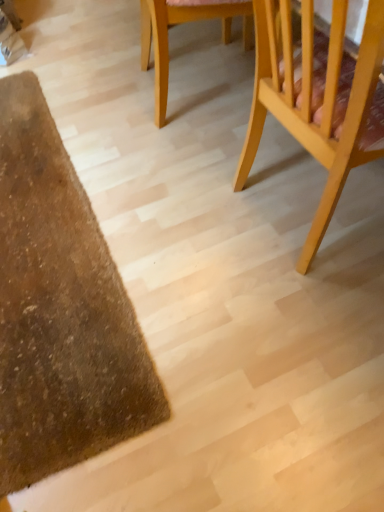
Question: Is light wood chair at right, placed as the 2th chair when sorted from left to right, bigger or smaller than light wood chair at upper center, the 1th chair when ordered from left to right?

Choices:
 (A) big
 (B) small

Answer: (A)

Question: From the image's perspective, is light wood chair at right, placed as the 2th chair when sorted from left to right, positioned above or below light wood chair at upper center, the 1th chair when ordered from left to right?

Choices:
 (A) above
 (B) below

Answer: (B)

Question: Is point (365, 22) closer or farther from the camera than point (168, 52)?

Choices:
 (A) closer
 (B) farther

Answer: (A)

Question: Considering the relative positions of light wood chair at upper center, marked as the 2th chair in a right-to-left arrangement, and light wood chair at right, placed as the 2th chair when sorted from left to right, in the image provided, is light wood chair at upper center, marked as the 2th chair in a right-to-left arrangement, to the left or to the right of light wood chair at right, placed as the 2th chair when sorted from left to right,?

Choices:
 (A) left
 (B) right

Answer: (A)

Question: Choose the correct answer: Is light wood chair at upper center, the 1th chair when ordered from left to right, inside light wood chair at right, placed as the 2th chair when sorted from left to right, or outside it?

Choices:
 (A) inside
 (B) outside

Answer: (B)

Question: Considering the positions of light wood chair at upper center, marked as the 2th chair in a right-to-left arrangement, and light wood chair at right, placed as the 2th chair when sorted from left to right, in the image, is light wood chair at upper center, marked as the 2th chair in a right-to-left arrangement, taller or shorter than light wood chair at right, placed as the 2th chair when sorted from left to right,?

Choices:
 (A) short
 (B) tall

Answer: (A)

Question: Is light wood chair at upper center, the 1th chair when ordered from left to right, wider or thinner than light wood chair at right, placed as the 2th chair when sorted from left to right?

Choices:
 (A) thin
 (B) wide

Answer: (A)